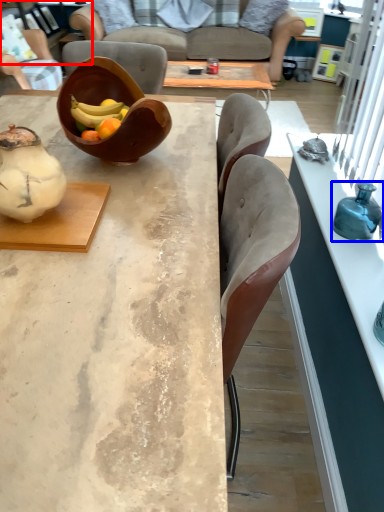
Question: Which point is closer to the camera, cabinetry (highlighted by a red box) or bottle (highlighted by a blue box)?

Choices:
 (A) cabinetry
 (B) bottle

Answer: (B)